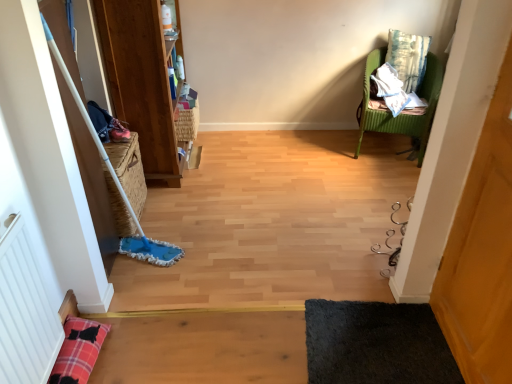
The height and width of the screenshot is (384, 512). In order to click on blank area to the left of green ribbed chair at upper right in this screenshot , I will do `click(328, 147)`.